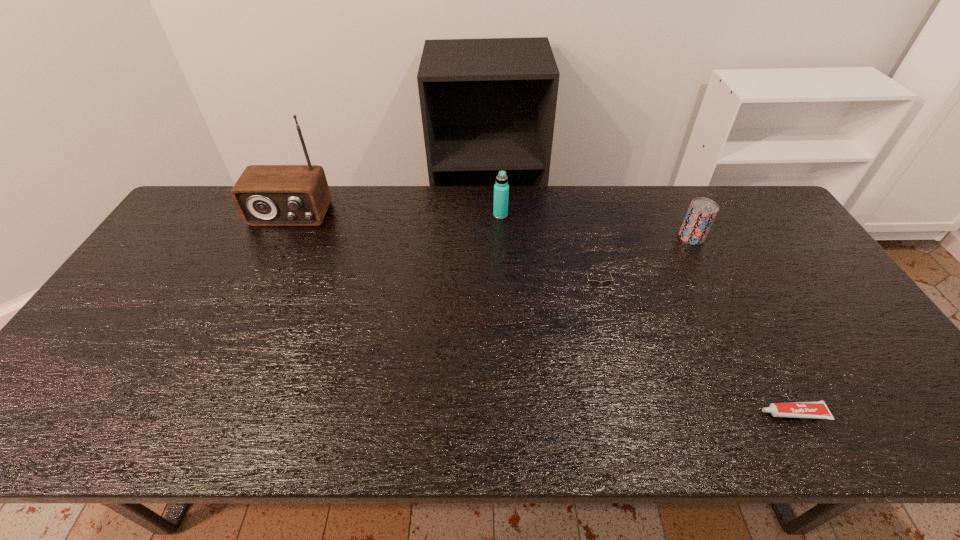
Locate an element on the screen. Image resolution: width=960 pixels, height=540 pixels. blank space at the far edge is located at coordinates (524, 202).

Identify the location of vacant space at the near edge of the desktop. The image size is (960, 540). (109, 426).

The height and width of the screenshot is (540, 960). What are the coordinates of `free point at the left edge` in the screenshot? It's located at tap(117, 369).

Where is `vacant space at the right edge of the desktop`? This screenshot has width=960, height=540. vacant space at the right edge of the desktop is located at coordinates (799, 287).

The height and width of the screenshot is (540, 960). I want to click on vacant space at the far left corner of the desktop, so click(x=227, y=213).

I want to click on free space at the near left corner of the desktop, so click(79, 417).

In the image, there is a desktop. Where is `free region at the near right corner`? This screenshot has width=960, height=540. free region at the near right corner is located at coordinates (853, 411).

I want to click on free point between the tallest object and the third object from left to right, so click(x=443, y=251).

The height and width of the screenshot is (540, 960). I want to click on vacant space in between the leftmost object and the fourth object from right to left, so click(x=396, y=214).

At what (x,y) coordinates should I click in order to perform the action: click on free area in between the water bottle and the tallest object. Please return your answer as a coordinate pair (x, y). The height and width of the screenshot is (540, 960). Looking at the image, I should click on (396, 214).